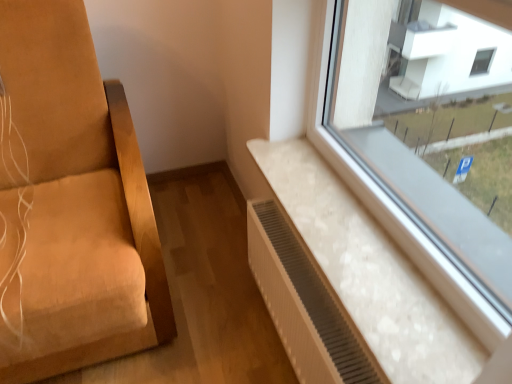
Question: Is white textured radiator at lower right inside or outside of white marble radiator at lower right?

Choices:
 (A) inside
 (B) outside

Answer: (B)

Question: From the image's perspective, is white textured radiator at lower right above or below white marble radiator at lower right?

Choices:
 (A) below
 (B) above

Answer: (A)

Question: Is point (302, 322) closer or farther from the camera than point (379, 357)?

Choices:
 (A) farther
 (B) closer

Answer: (A)

Question: Is point (347, 266) closer or farther from the camera than point (350, 377)?

Choices:
 (A) farther
 (B) closer

Answer: (A)

Question: In the image, is white marble radiator at lower right positioned in front of or behind white textured radiator at lower right?

Choices:
 (A) front
 (B) behind

Answer: (A)

Question: Considering the positions of white marble radiator at lower right and white textured radiator at lower right in the image, is white marble radiator at lower right bigger or smaller than white textured radiator at lower right?

Choices:
 (A) big
 (B) small

Answer: (B)

Question: Is white marble radiator at lower right inside or outside of white textured radiator at lower right?

Choices:
 (A) inside
 (B) outside

Answer: (B)